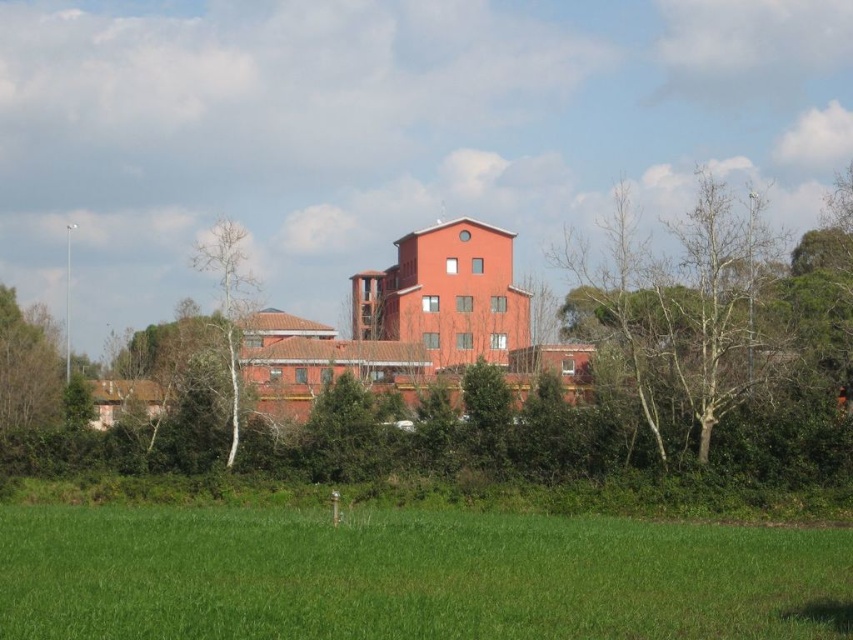
Is point (312, 611) more distant than point (196, 262)?

No, (312, 611) is closer to viewer.

Consider the image. Is green grass at lower center to the left of bare wood tree at left from the viewer's perspective?

In fact, green grass at lower center is to the right of bare wood tree at left.

Who is more distant from viewer, (x=846, y=609) or (x=236, y=449)?

The point (x=236, y=449) is more distant.

Where is `green grass at lower center`? This screenshot has width=853, height=640. green grass at lower center is located at coordinates (410, 576).